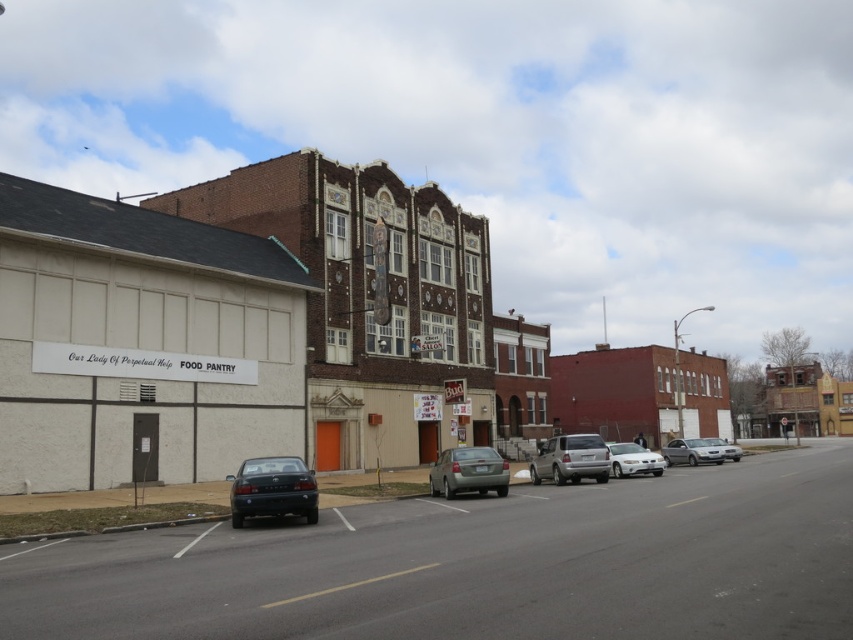
Question: Among these points, which one is nearest to the camera?

Choices:
 (A) (439, 476)
 (B) (711, 444)

Answer: (A)

Question: Is metallic silver sedan at center bigger than white glossy sedan at center?

Choices:
 (A) yes
 (B) no

Answer: (B)

Question: Which object appears farthest from the camera in this image?

Choices:
 (A) white glossy sedan at center
 (B) silver metallic suv at center
 (C) metallic silver sedan at center
 (D) matte black sedan at lower left

Answer: (A)

Question: Which object appears farthest from the camera in this image?

Choices:
 (A) matte black sedan at lower left
 (B) metallic silver sedan at center
 (C) silver metallic suv at center
 (D) silver metallic sedan at center-right

Answer: (D)

Question: Is silver metallic suv at center to the right of white glossy sedan at center from the viewer's perspective?

Choices:
 (A) no
 (B) yes

Answer: (A)

Question: In this image, where is white glossy sedan at center located relative to silver metallic sedan at center-right?

Choices:
 (A) left
 (B) right

Answer: (A)